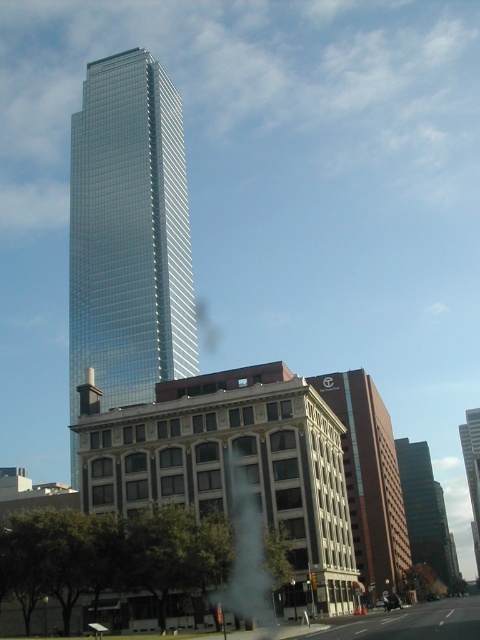
You are a drone operator trying to capture aerial footage of the cityscape. You have two points marked in the image for reference. Point A is at coordinates point (388, 577) and Point B is at point (454, 552). Which point should you prioritize for a closer shot if you want to focus on areas nearer to the camera?

Point A at point (388, 577) is closer to the camera than point (454, 552), so you should prioritize Point A for a closer shot.

You are a drone operator trying to capture aerial footage of the city. You need to fly your drone between the brown brick building at center and the glassy reflective skyscraper at center to get a clear shot of the street below. Is this possible given their positions?

The brown brick building at center is in front of the glassy reflective skyscraper at center, so there is a gap between them allowing the drone to fly through for a clear shot of the street below.